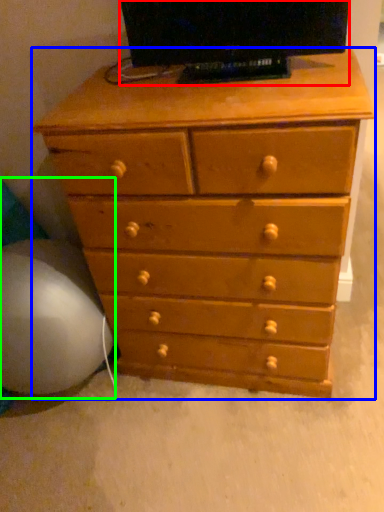
Question: Estimate the real-world distances between objects in this image. Which object is farther from television (highlighted by a red box), chest of drawers (highlighted by a blue box) or bean bag chair (highlighted by a green box)?

Choices:
 (A) chest of drawers
 (B) bean bag chair

Answer: (B)